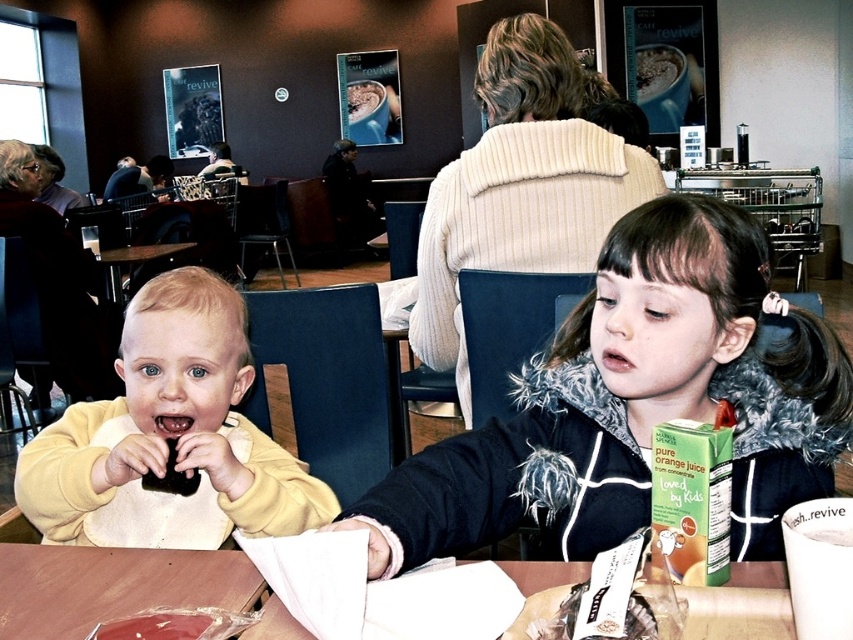
You are a parent trying to decide whether to put a small toy into the shiny plastic bag at table front or the fluffy black jacket at center. Which container can better hold the toy based on their sizes?

The fluffy black jacket at center is bigger than the shiny plastic bag at table front, so it can better hold the toy.

You are a parent at the table with your children. You need to pack up the shiny plastic bag at table front and the white paper bag at lower center. Which bag will you need to lift first if you want to place the taller one on top?

The white paper bag at lower center is taller than the shiny plastic bag at table front, so you should lift the shiny plastic bag at table front first to place the taller white paper bag at lower center on top.

You are a customer sitting at the table where the two children are. You want to place your phone on the table between the two points, point (x=512, y=435) and point (x=119, y=600). Since you don not want your phone to slide off the table, will placing it between these two points be safe?

Point (x=512, y=435) is further to the viewer than point (x=119, y=600), so the area between them slopes downward towards point (x=119, y=600). Placing your phone there may cause it to slide towards point (x=119, y=600). To prevent sliding, place it closer to point (x=512, y=435) where it is higher.